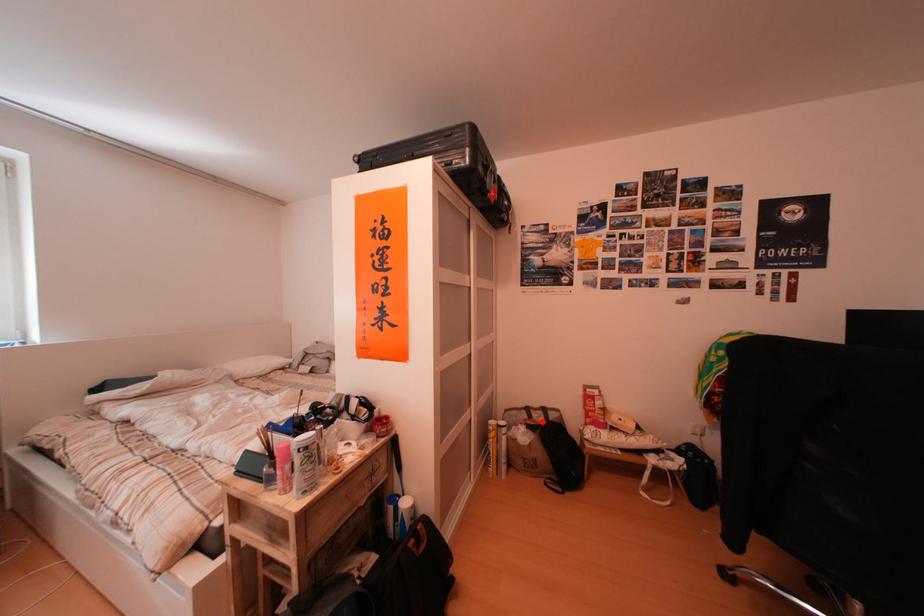
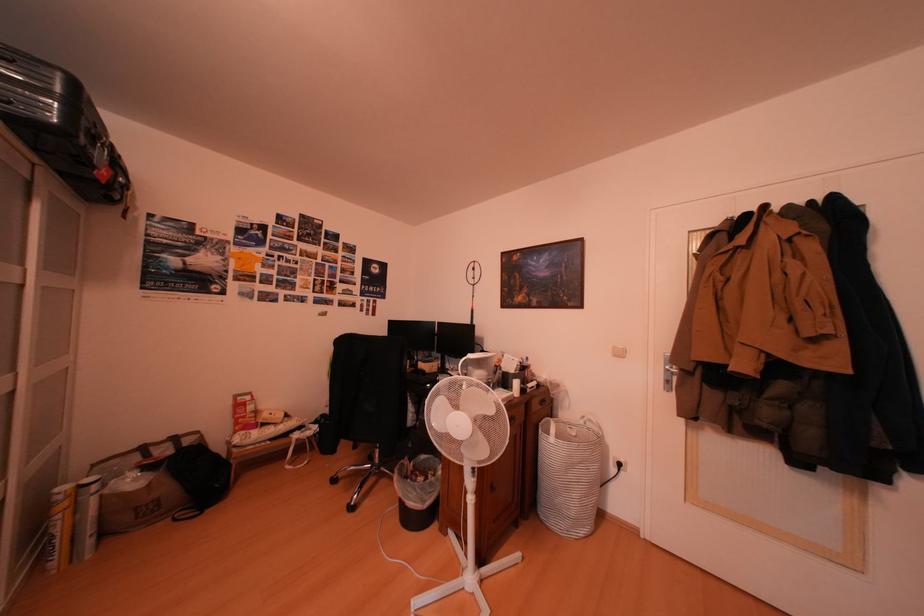
Question: I am providing you with two images of the same scene from different viewpoints. Given a red point in image1, look at the same physical point in image2. Is it:

Choices:
 (A) Closer to the viewpoint
 (B) Farther from the viewpoint

Answer: (A)